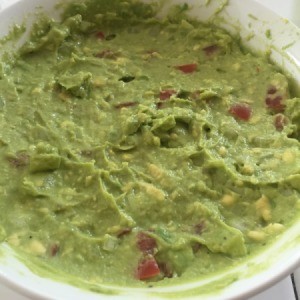
Where is `white bowl`? white bowl is located at coordinates (271, 273).